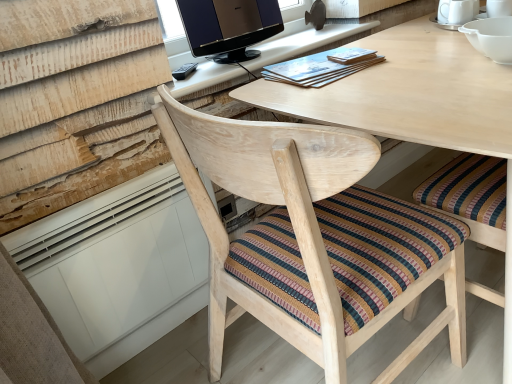
This screenshot has height=384, width=512. In order to click on vacant area that is situated to the right of matte wooden book at upper center, the 2th book in the right-to-left sequence in this screenshot , I will do `click(408, 54)`.